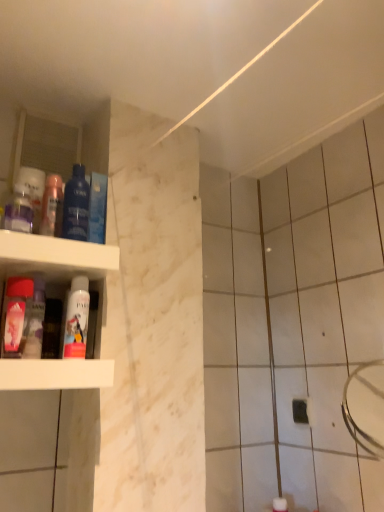
Question: Is blue glossy mouthwash at left, which ranks as the 4th mouthwash in left-to-right order, thinner than blue glossy mouthwash at upper left, which is the 6th mouthwash from left to right?

Choices:
 (A) yes
 (B) no

Answer: (B)

Question: Considering the relative sizes of blue glossy mouthwash at left, the third mouthwash in the right-to-left sequence, and blue glossy mouthwash at upper left, which is the 6th mouthwash from left to right, in the image provided, is blue glossy mouthwash at left, the third mouthwash in the right-to-left sequence, smaller than blue glossy mouthwash at upper left, which is the 6th mouthwash from left to right,?

Choices:
 (A) yes
 (B) no

Answer: (B)

Question: Considering the relative sizes of blue glossy mouthwash at left, which ranks as the 4th mouthwash in left-to-right order, and blue glossy mouthwash at upper left, which is the 6th mouthwash from left to right, in the image provided, is blue glossy mouthwash at left, which ranks as the 4th mouthwash in left-to-right order, wider than blue glossy mouthwash at upper left, which is the 6th mouthwash from left to right,?

Choices:
 (A) yes
 (B) no

Answer: (A)

Question: Is blue glossy mouthwash at left, which ranks as the 4th mouthwash in left-to-right order, far away from blue glossy mouthwash at upper left, which is the 6th mouthwash from left to right?

Choices:
 (A) no
 (B) yes

Answer: (A)

Question: Can you confirm if blue glossy mouthwash at left, the third mouthwash in the right-to-left sequence, is bigger than blue glossy mouthwash at upper left, the 1th mouthwash positioned from the right?

Choices:
 (A) no
 (B) yes

Answer: (B)

Question: From the image's perspective, is translucent plastic mouthwash at left, arranged as the second mouthwash when viewed from the left, located above or below translucent plastic mouthwash at upper left, the third mouthwash positioned from the left?

Choices:
 (A) below
 (B) above

Answer: (A)

Question: Is translucent plastic mouthwash at left, arranged as the second mouthwash when viewed from the left, situated inside translucent plastic mouthwash at upper left, the third mouthwash positioned from the left, or outside?

Choices:
 (A) inside
 (B) outside

Answer: (B)

Question: Considering the positions of translucent plastic mouthwash at left, placed as the 5th mouthwash when sorted from right to left, and translucent plastic mouthwash at upper left, the third mouthwash positioned from the left, in the image, is translucent plastic mouthwash at left, placed as the 5th mouthwash when sorted from right to left, taller or shorter than translucent plastic mouthwash at upper left, the third mouthwash positioned from the left,?

Choices:
 (A) tall
 (B) short

Answer: (A)

Question: From a real-world perspective, is translucent plastic mouthwash at left, arranged as the second mouthwash when viewed from the left, physically located above or below translucent plastic mouthwash at upper left, the third mouthwash positioned from the left?

Choices:
 (A) above
 (B) below

Answer: (B)

Question: From a real-world perspective, is blue glossy mouthwash at left, the third mouthwash in the right-to-left sequence, positioned above or below blue glossy mouthwash at upper left, the 1th mouthwash positioned from the right?

Choices:
 (A) above
 (B) below

Answer: (A)

Question: Is blue glossy mouthwash at left, the third mouthwash in the right-to-left sequence, bigger or smaller than blue glossy mouthwash at upper left, which is the 6th mouthwash from left to right?

Choices:
 (A) big
 (B) small

Answer: (A)

Question: From the image's perspective, is blue glossy mouthwash at left, the third mouthwash in the right-to-left sequence, positioned above or below blue glossy mouthwash at upper left, which is the 6th mouthwash from left to right?

Choices:
 (A) below
 (B) above

Answer: (B)

Question: Is blue glossy mouthwash at left, which ranks as the 4th mouthwash in left-to-right order, taller or shorter than blue glossy mouthwash at upper left, the 1th mouthwash positioned from the right?

Choices:
 (A) tall
 (B) short

Answer: (A)

Question: From the image's perspective, is pink matte spray can at lower left, acting as the 2th mouthwash starting from the right, positioned above or below translucent plastic mouthwash at upper left, the third mouthwash positioned from the left?

Choices:
 (A) below
 (B) above

Answer: (A)

Question: From a real-world perspective, is pink matte spray can at lower left, acting as the 2th mouthwash starting from the right, positioned above or below translucent plastic mouthwash at upper left, the third mouthwash positioned from the left?

Choices:
 (A) below
 (B) above

Answer: (A)